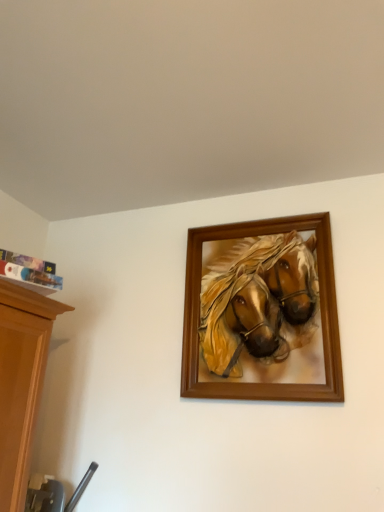
The height and width of the screenshot is (512, 384). What do you see at coordinates (262, 312) in the screenshot? I see `wooden picture frame at upper center` at bounding box center [262, 312].

Identify the location of wooden picture frame at upper center. (262, 312).

Measure the distance between point (273, 294) and camera.

Point (273, 294) and camera are 4.95 feet apart.

Locate an element on the screen. wooden picture frame at upper center is located at coordinates (262, 312).